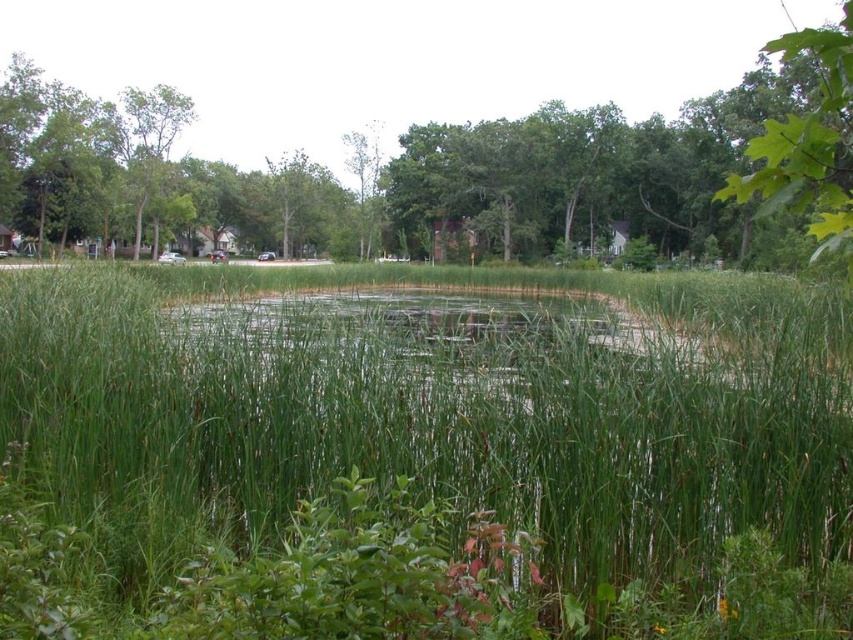
Is green leafy tree at center above green leafy tree at upper right?

Yes, green leafy tree at center is above green leafy tree at upper right.

Is green leafy tree at center further to the viewer compared to green leafy tree at upper right?

No, green leafy tree at center is closer to the viewer.

Image resolution: width=853 pixels, height=640 pixels. What do you see at coordinates (456, 172) in the screenshot?
I see `green leafy tree at center` at bounding box center [456, 172].

Locate an element on the screen. Image resolution: width=853 pixels, height=640 pixels. green leafy tree at center is located at coordinates click(x=456, y=172).

Which is above, green grass at center or green leafy tree at upper right?

green leafy tree at upper right is above.

Is point (830, 552) closer to viewer compared to point (809, 177)?

That is False.

Consider the image. Who is more forward, (228, 433) or (796, 179)?

Positioned in front is point (796, 179).

Identify the location of green grass at center. (421, 456).

Does green grass at center have a smaller size compared to green leafy tree at center?

Yes.

Can you confirm if green grass at center is thinner than green leafy tree at center?

Yes, green grass at center is thinner than green leafy tree at center.

Image resolution: width=853 pixels, height=640 pixels. I want to click on green grass at center, so click(x=421, y=456).

Image resolution: width=853 pixels, height=640 pixels. In order to click on green grass at center in this screenshot , I will do `click(421, 456)`.